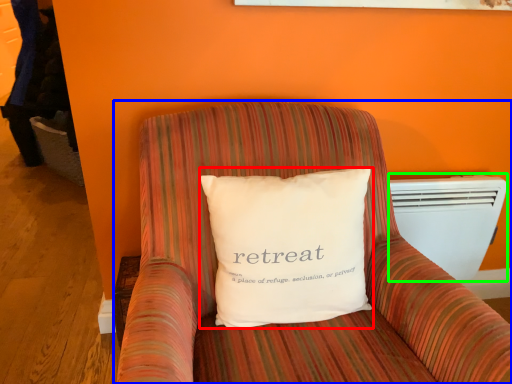
Question: Considering the real-world distances, which object is closest to pillow (highlighted by a red box)? furniture (highlighted by a blue box) or air conditioning (highlighted by a green box).

Choices:
 (A) furniture
 (B) air conditioning

Answer: (A)